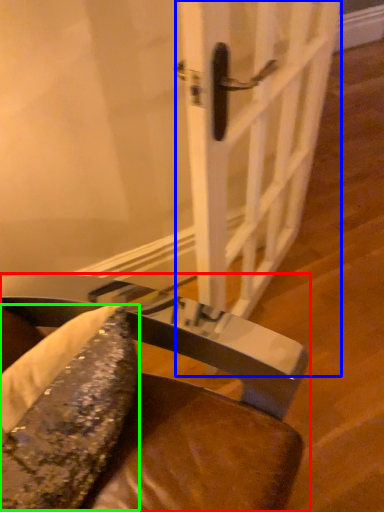
Question: Based on their relative distances, which object is farther from chair (highlighted by a red box)? Choose from door (highlighted by a blue box) and food (highlighted by a green box).

Choices:
 (A) door
 (B) food

Answer: (A)